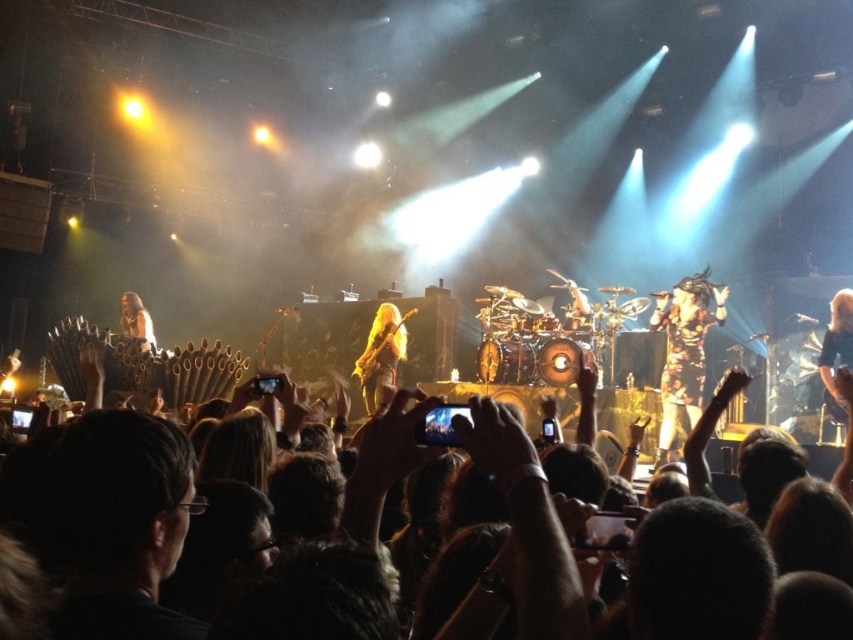
Which is more to the right, dark hair at lower center or long hair at center?

dark hair at lower center is more to the right.

Between point (636, 563) and point (138, 314), which one is positioned behind?

Positioned behind is point (138, 314).

Does point (543, 525) come closer to viewer compared to point (151, 336)?

Yes, it is in front of point (151, 336).

At what (x,y) coordinates should I click in order to perform the action: click on dark hair at lower center. Please return your answer as a coordinate pair (x, y). Looking at the image, I should click on (527, 525).

Can you confirm if dark hair at lower center is taller than shiny gold guitar at center?

In fact, dark hair at lower center may be shorter than shiny gold guitar at center.

Who is more distant from viewer, (563, 548) or (358, 380)?

Point (358, 380)

Find the location of a particular element. This screenshot has width=853, height=640. dark hair at lower center is located at coordinates (527, 525).

At what (x,y) coordinates should I click in order to perform the action: click on dark hair at lower center. Please return your answer as a coordinate pair (x, y). The image size is (853, 640). Looking at the image, I should click on (527, 525).

This screenshot has width=853, height=640. What do you see at coordinates (683, 348) in the screenshot?
I see `floral-patterned dress at center` at bounding box center [683, 348].

Does point (689, 349) come closer to viewer compared to point (137, 305)?

Yes, point (689, 349) is closer to viewer.

Image resolution: width=853 pixels, height=640 pixels. What are the coordinates of `floral-patterned dress at center` in the screenshot? It's located at (683, 348).